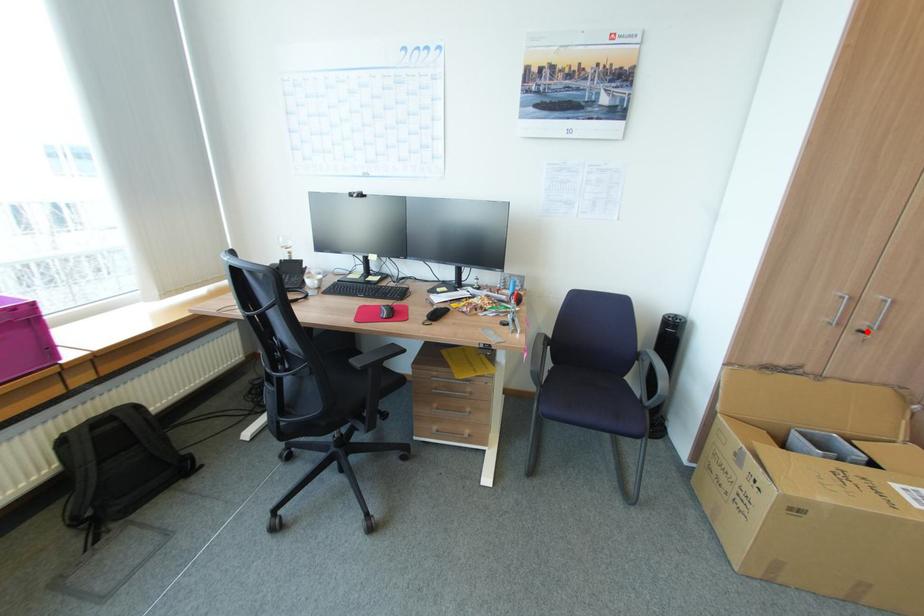
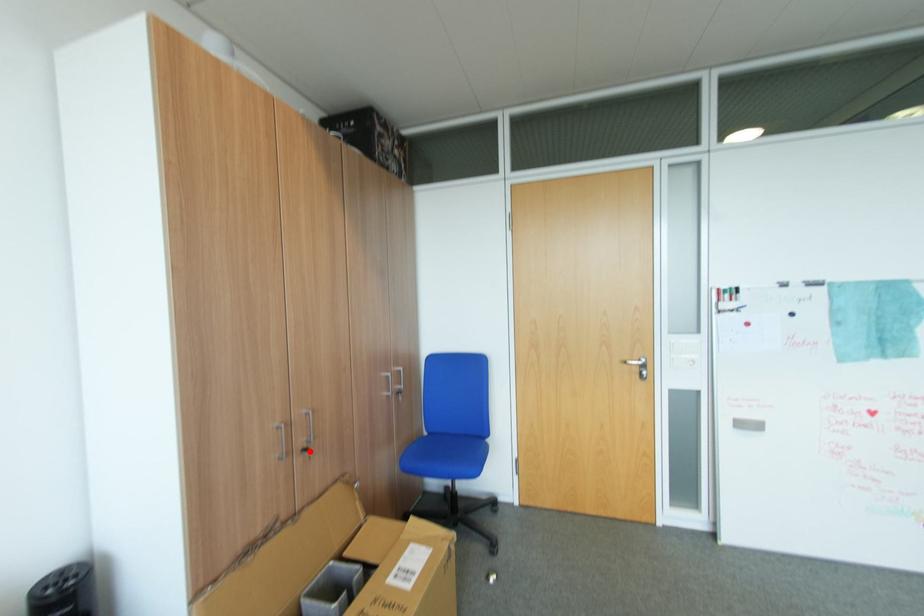
I am providing you with two images of the same scene from different viewpoints. A red point is marked on the first image and another point is marked on the second image. Is the marked point in image1 the same physical position as the marked point in image2?

Yes